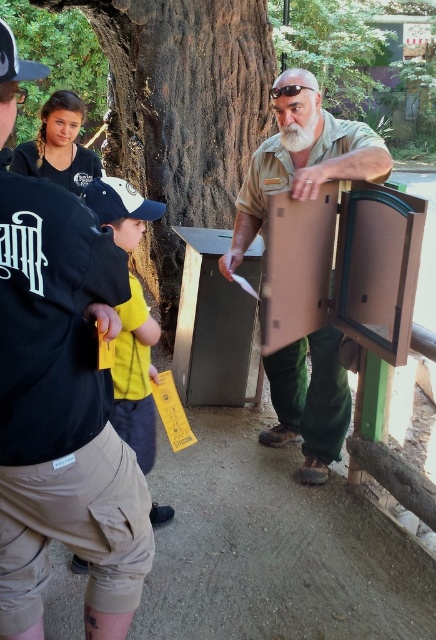
Question: Is matte cardboard box at center wider than green textured tree at upper left?

Choices:
 (A) yes
 (B) no

Answer: (B)

Question: Which point is farther to the camera?

Choices:
 (A) (12, 20)
 (B) (118, 392)

Answer: (A)

Question: Does green leafy tree at center have a lesser width compared to green textured tree at upper left?

Choices:
 (A) yes
 (B) no

Answer: (B)

Question: Which object appears farthest from the camera in this image?

Choices:
 (A) matte cardboard box at center
 (B) matte brown uniform at center
 (C) matte brown suitcase at center
 (D) brown cardboard box at center

Answer: (A)

Question: Among these objects, which one is farthest from the camera?

Choices:
 (A) yellow cotton shirt at left
 (B) green leafy tree at center
 (C) white matte baseball cap at left

Answer: (B)

Question: Does brown cardboard box at center lie behind green textured tree at upper left?

Choices:
 (A) yes
 (B) no

Answer: (B)